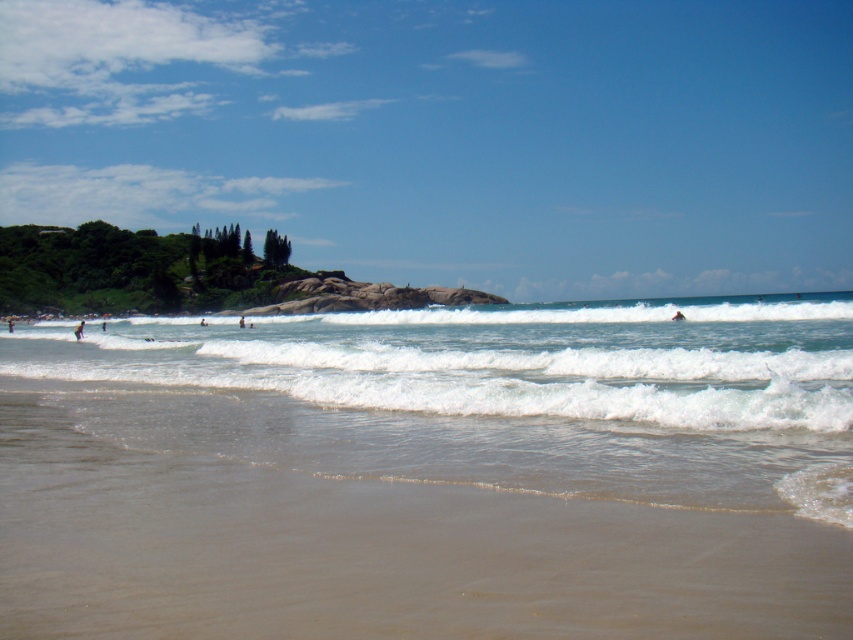
Question: Which object appears farthest from the camera in this image?

Choices:
 (A) blue fabric surfboard at right
 (B) brown sandy beach at lower center
 (C) white surfboard at center

Answer: (C)

Question: Can you confirm if clear blue water at center is smaller than dark blue skin at lower left?

Choices:
 (A) yes
 (B) no

Answer: (B)

Question: Does clear blue water at center have a lesser width compared to dark brown surfboard at left?

Choices:
 (A) yes
 (B) no

Answer: (B)

Question: Among these objects, which one is nearest to the camera?

Choices:
 (A) dark brown surfboard at left
 (B) dark blue skin at lower left
 (C) brown sandy beach at lower center

Answer: (C)

Question: Which object is farther from the camera taking this photo?

Choices:
 (A) dark brown surfboard at left
 (B) brown sandy beach at lower center
 (C) blue fabric surfboard at right
 (D) dark blue skin at lower left

Answer: (A)

Question: Can you confirm if transparent blue sky at upper center is thinner than blue fabric surfboard at right?

Choices:
 (A) no
 (B) yes

Answer: (A)